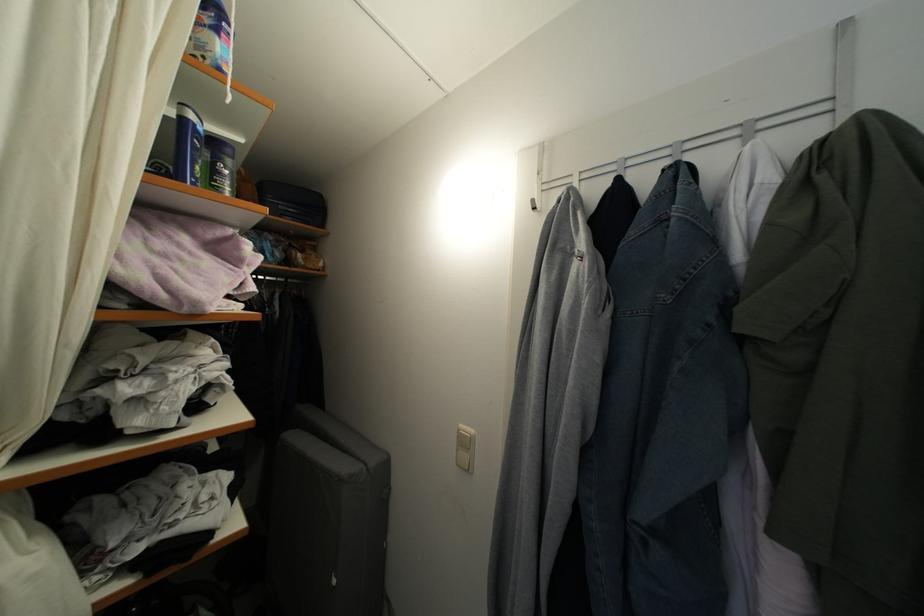
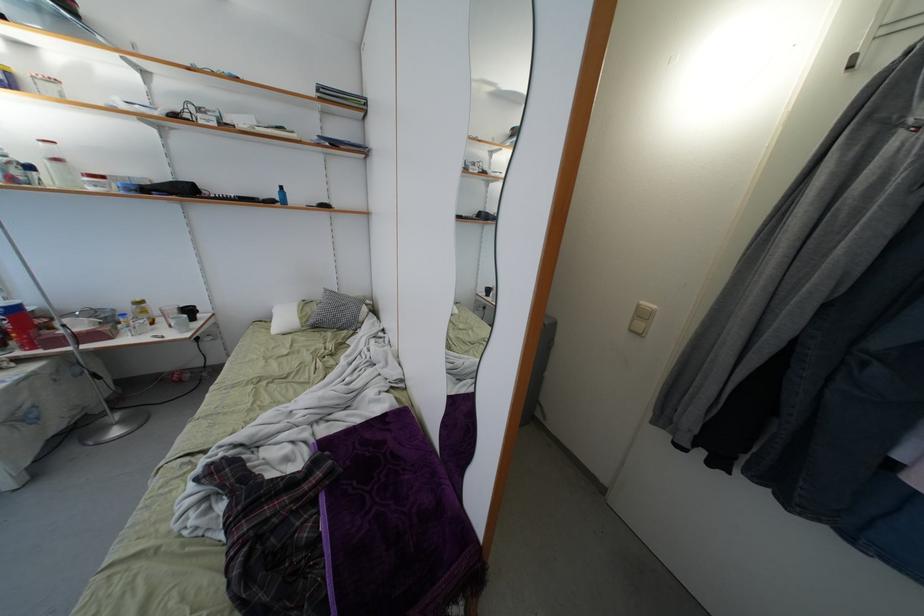
The images are taken continuously from a first-person perspective. In which direction is your viewpoint rotating?

The camera's rotation is toward left-down.